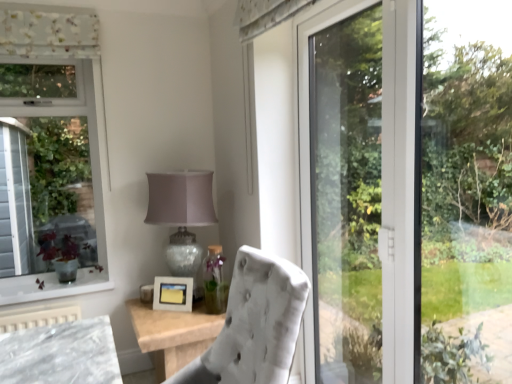
Question: Is matte glass table lamp at center in front of or behind white matte picture frame at center in the image?

Choices:
 (A) front
 (B) behind

Answer: (A)

Question: From their relative heights in the image, would you say matte glass table lamp at center is taller or shorter than white matte picture frame at center?

Choices:
 (A) tall
 (B) short

Answer: (A)

Question: Which object is the closest to the matte glass table lamp at center?

Choices:
 (A) white matte picture frame at center
 (B) transparent glass door at right
 (C) velvet white chair at center

Answer: (A)

Question: Which object is positioned farthest from the matte glass table lamp at center?

Choices:
 (A) velvet white chair at center
 (B) white matte picture frame at center
 (C) transparent glass door at right

Answer: (A)